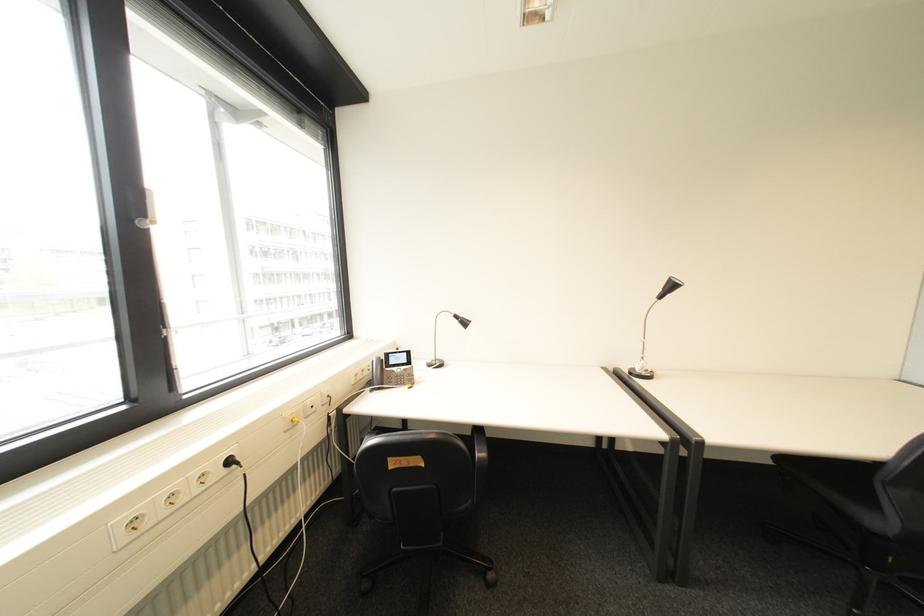
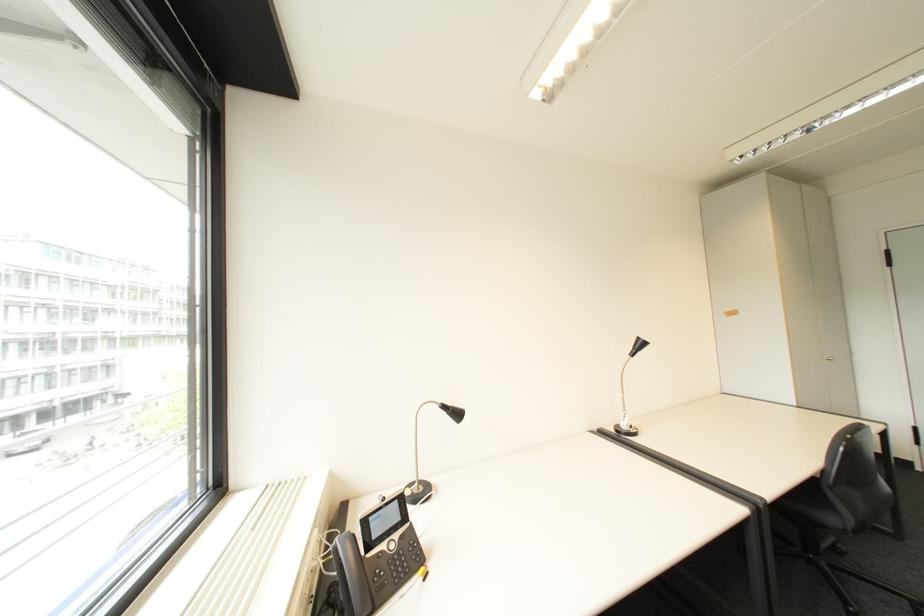
Question: Based on the continuous images, in which direction is the camera rotating? Reply with the corresponding letter.

Choices:
 (A) Left
 (B) Right
 (C) Up
 (D) Down

Answer: (B)